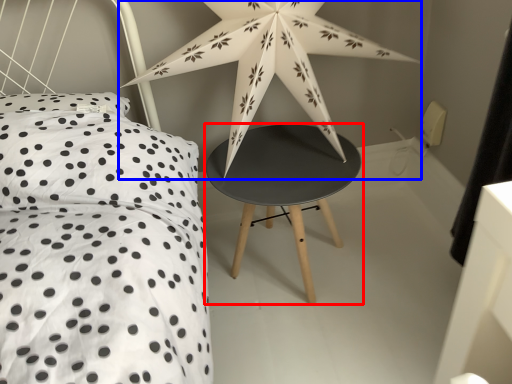
Question: Which of the following is the farthest to the observer, stool (highlighted by a red box) or star (highlighted by a blue box)?

Choices:
 (A) stool
 (B) star

Answer: (A)